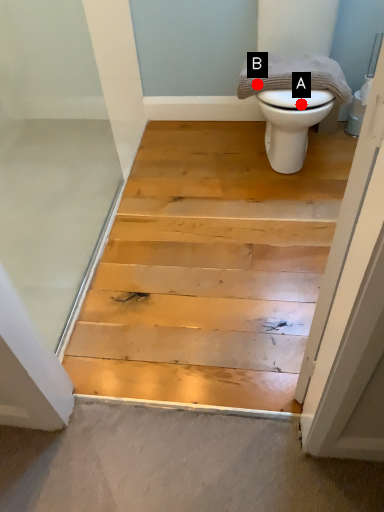
Question: Two points are circled on the image, labeled by A and B beside each circle. Which point is farther to the camera?

Choices:
 (A) A is further
 (B) B is further

Answer: (B)